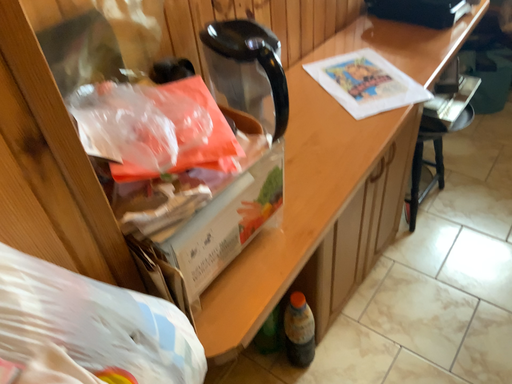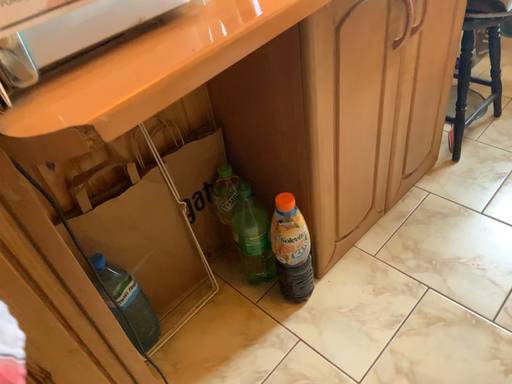
Question: How did the camera likely rotate when shooting the video?

Choices:
 (A) rotated right
 (B) rotated left

Answer: (B)